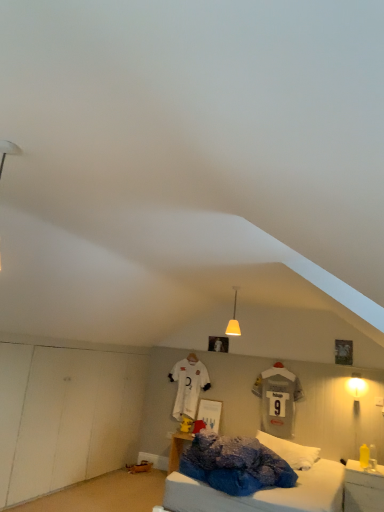
Question: Does matte yellow glass pendant light at center, marked as the 1th light fixture in a left-to-right arrangement, have a smaller size compared to matte yellow lampshade at right, which is the second light fixture in top-to-bottom order?

Choices:
 (A) yes
 (B) no

Answer: (B)

Question: Is matte yellow glass pendant light at center, the 2th light fixture ordered from the bottom, far away from matte yellow lampshade at right, the 1th light fixture when ordered from right to left?

Choices:
 (A) yes
 (B) no

Answer: (A)

Question: Would you say matte yellow lampshade at right, the first light fixture positioned from the back, is part of matte yellow glass pendant light at center, arranged as the 1th light fixture when viewed from the front,'s contents?

Choices:
 (A) yes
 (B) no

Answer: (B)

Question: Is matte yellow glass pendant light at center, marked as the 1th light fixture in a left-to-right arrangement, thinner than matte yellow lampshade at right, marked as the 2th light fixture in a left-to-right arrangement?

Choices:
 (A) no
 (B) yes

Answer: (A)

Question: From a real-world perspective, is matte yellow glass pendant light at center, arranged as the 1th light fixture when viewed from the front, located beneath matte yellow lampshade at right, acting as the 1th light fixture starting from the bottom?

Choices:
 (A) yes
 (B) no

Answer: (B)

Question: In terms of size, does white fluffy pillow at center appear bigger or smaller than matte yellow glass pendant light at center, the 2th light fixture ordered from the bottom?

Choices:
 (A) big
 (B) small

Answer: (A)

Question: From the image's perspective, is white fluffy pillow at center above or below matte yellow glass pendant light at center, the 2th light fixture ordered from the bottom?

Choices:
 (A) below
 (B) above

Answer: (A)

Question: Considering the positions of white fluffy pillow at center and matte yellow glass pendant light at center, the 2th light fixture ordered from the bottom, in the image, is white fluffy pillow at center taller or shorter than matte yellow glass pendant light at center, the 2th light fixture ordered from the bottom,?

Choices:
 (A) short
 (B) tall

Answer: (A)

Question: Is white fluffy pillow at center in front of or behind matte yellow glass pendant light at center, arranged as the second light fixture when viewed from the back, in the image?

Choices:
 (A) behind
 (B) front

Answer: (A)

Question: From a real-world perspective, is yellow plastic bottle at lower right above or below white fluffy pillow at center?

Choices:
 (A) below
 (B) above

Answer: (A)

Question: Choose the correct answer: Is yellow plastic bottle at lower right inside white fluffy pillow at center or outside it?

Choices:
 (A) outside
 (B) inside

Answer: (A)

Question: In terms of size, does yellow plastic bottle at lower right appear bigger or smaller than white fluffy pillow at center?

Choices:
 (A) small
 (B) big

Answer: (A)

Question: In terms of height, does yellow plastic bottle at lower right look taller or shorter compared to white fluffy pillow at center?

Choices:
 (A) tall
 (B) short

Answer: (A)

Question: From the image's perspective, is white fluffy pillow at center positioned above or below yellow plastic bottle at lower right?

Choices:
 (A) below
 (B) above

Answer: (B)

Question: Does point (296, 450) appear closer or farther from the camera than point (344, 494)?

Choices:
 (A) closer
 (B) farther

Answer: (B)